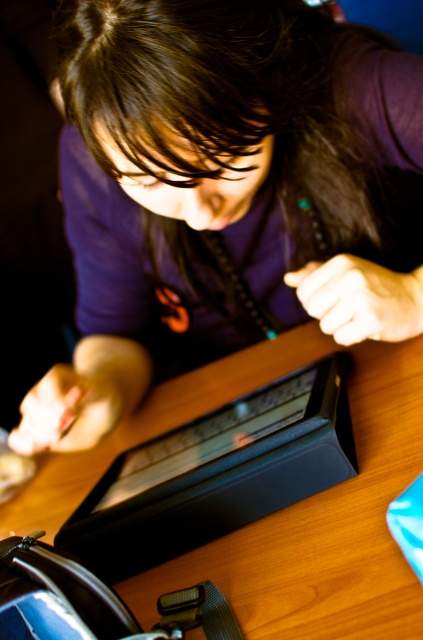
Question: Can you confirm if purple matte shirt at upper center is bigger than wooden table at center?

Choices:
 (A) no
 (B) yes

Answer: (B)

Question: In this image, where is purple matte shirt at upper center located relative to wooden table at center?

Choices:
 (A) left
 (B) right

Answer: (A)

Question: Considering the relative positions of purple matte shirt at upper center and wooden table at center in the image provided, where is purple matte shirt at upper center located with respect to wooden table at center?

Choices:
 (A) below
 (B) above

Answer: (B)

Question: Which point appears farthest from the camera in this image?

Choices:
 (A) (192, 220)
 (B) (0, 516)

Answer: (B)

Question: Which object appears closest to the camera in this image?

Choices:
 (A) wooden table at center
 (B) purple matte shirt at upper center

Answer: (A)